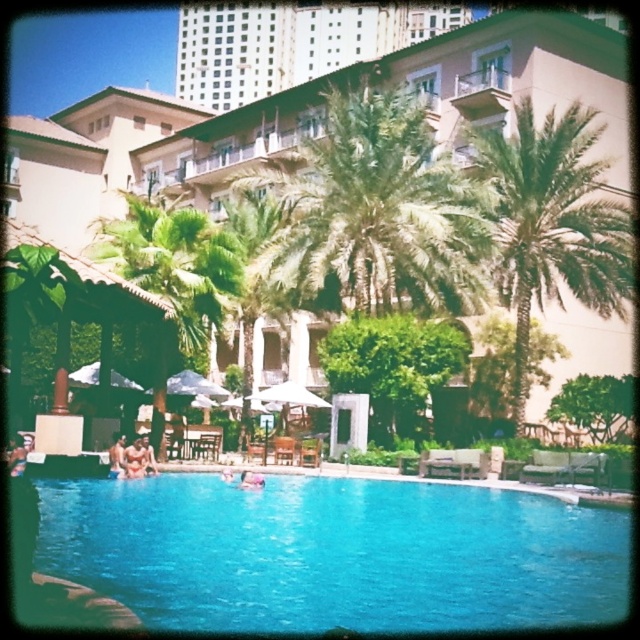
Between blue glassy swimming pool at center and tan skin person at lower center, which one has more height?

Standing taller between the two is blue glassy swimming pool at center.

Who is more forward, (572, 560) or (147, 449)?

Point (572, 560) is in front.

Is point (113, 492) more distant than point (154, 461)?

No, it is in front of (154, 461).

Identify the location of blue glassy swimming pool at center. Image resolution: width=640 pixels, height=640 pixels. (333, 554).

Is blue glossy pool at center above pink fabric at center?

Yes, blue glossy pool at center is above pink fabric at center.

The width and height of the screenshot is (640, 640). I want to click on blue glossy pool at center, so click(x=353, y=81).

The height and width of the screenshot is (640, 640). I want to click on blue glossy pool at center, so click(x=353, y=81).

Does blue glassy swimming pool at center have a larger size compared to skinny jeans at lower left?

Correct, blue glassy swimming pool at center is larger in size than skinny jeans at lower left.

What do you see at coordinates (333, 554) in the screenshot? I see `blue glassy swimming pool at center` at bounding box center [333, 554].

The width and height of the screenshot is (640, 640). Describe the element at coordinates (333, 554) in the screenshot. I see `blue glassy swimming pool at center` at that location.

At what (x,y) coordinates should I click in order to perform the action: click on blue glassy swimming pool at center. Please return your answer as a coordinate pair (x, y). Looking at the image, I should click on (333, 554).